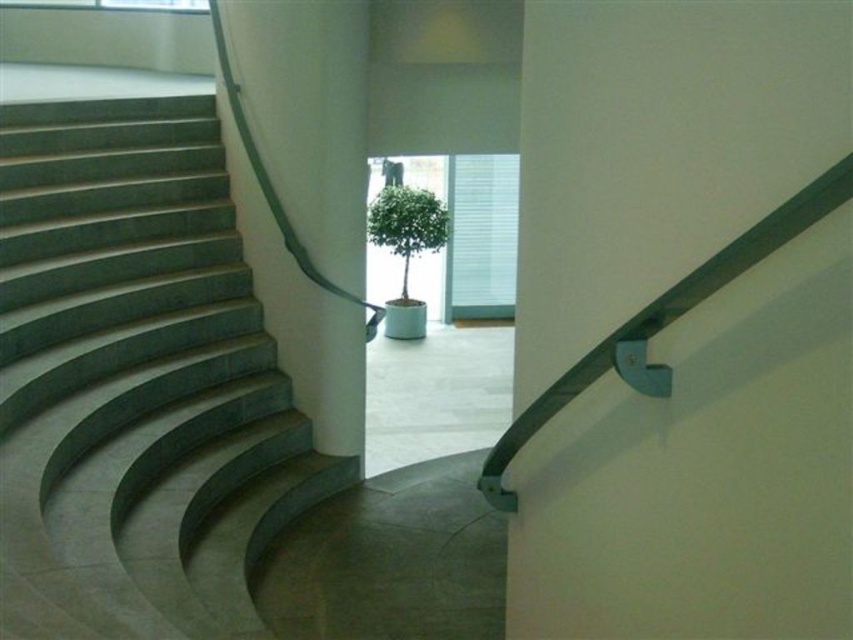
Question: Which object is farther from the camera taking this photo?

Choices:
 (A) white smooth pillar at center
 (B) green matte plant at center
 (C) green matte handrail at upper right

Answer: (B)

Question: Which of the following is the closest to the observer?

Choices:
 (A) green polished concrete stairs at left
 (B) white smooth pillar at center
 (C) green matte handrail at upper right

Answer: (C)

Question: Among these objects, which one is farthest from the camera?

Choices:
 (A) green matte handrail at upper right
 (B) white smooth pillar at center
 (C) green matte plant at center

Answer: (C)

Question: Is the position of green matte handrail at upper right more distant than that of white smooth pillar at center?

Choices:
 (A) yes
 (B) no

Answer: (B)

Question: Is green polished concrete stairs at left above white smooth pillar at center?

Choices:
 (A) no
 (B) yes

Answer: (A)

Question: Does green matte handrail at upper right appear under green matte plant at center?

Choices:
 (A) yes
 (B) no

Answer: (A)